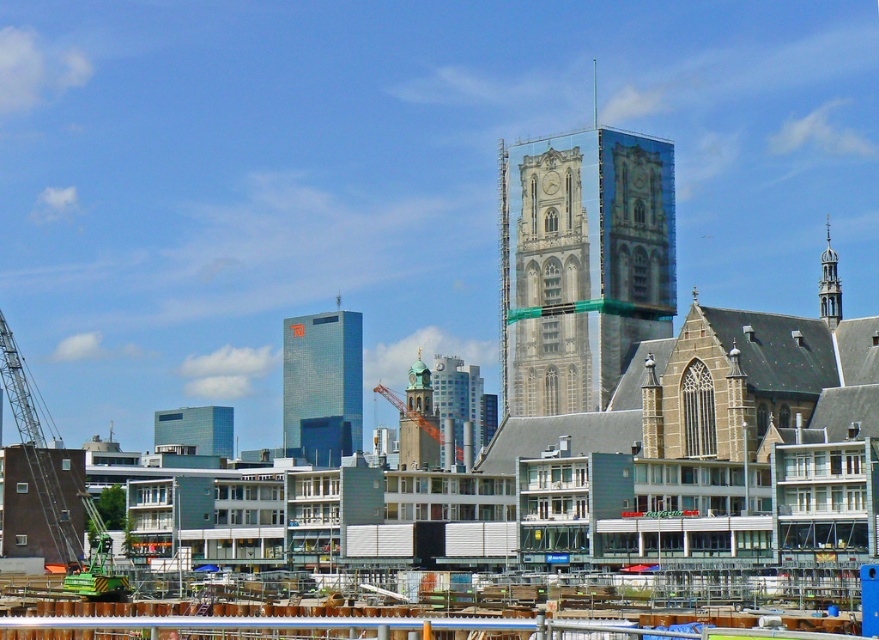
Question: Estimate the real-world distances between objects in this image. Which object is farther from the orange metallic crane at center?

Choices:
 (A) stone gothic bell tower at center
 (B) green metallic crane at left

Answer: (B)

Question: Is metallic glass tower at center wider than gold metallic spire at upper right?

Choices:
 (A) yes
 (B) no

Answer: (B)

Question: From the image, what is the correct spatial relationship of metal scaffolding at center in relation to green metallic crane at left?

Choices:
 (A) below
 (B) above

Answer: (B)

Question: Can you confirm if metallic glass tower at center is positioned above gold metallic spire at upper right?

Choices:
 (A) no
 (B) yes

Answer: (A)

Question: Estimate the real-world distances between objects in this image. Which object is closer to the metal scaffolding at center?

Choices:
 (A) gold metallic spire at upper right
 (B) metallic glass tower at center
 (C) green metallic crane at left
 (D) orange metallic crane at center

Answer: (C)

Question: Which point is farther from the camera taking this photo?

Choices:
 (A) (322, 330)
 (B) (391, 397)
 (C) (850, 618)

Answer: (A)